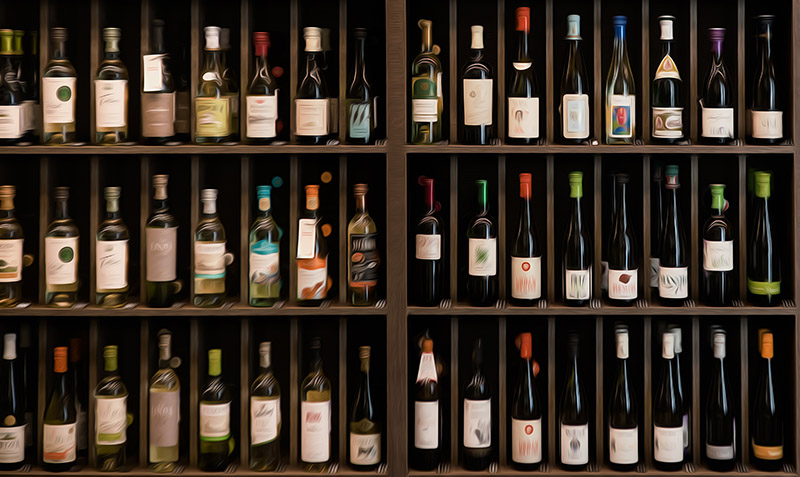
The width and height of the screenshot is (800, 477). Identify the location of shelves. (190, 151), (545, 150), (270, 317), (517, 313), (257, 475), (549, 475).